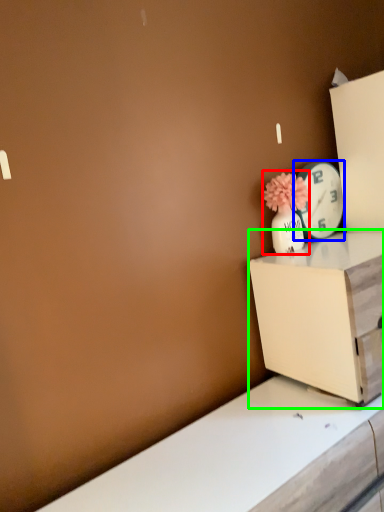
Question: Considering the real-world distances, which object is closest to floral arrangement (highlighted by a red box)? clock (highlighted by a blue box) or nightstand (highlighted by a green box).

Choices:
 (A) clock
 (B) nightstand

Answer: (A)